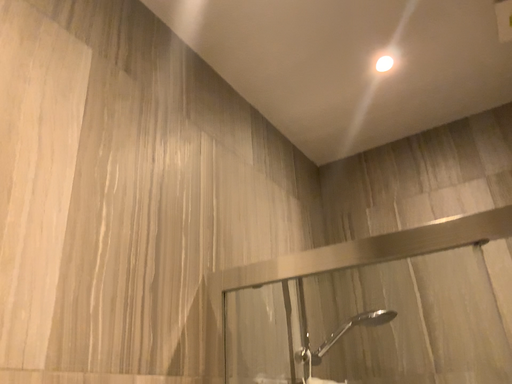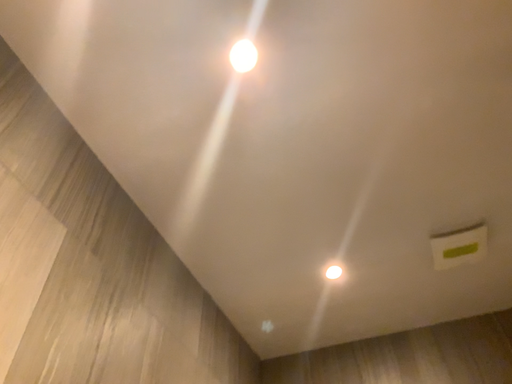
Question: Which way did the camera rotate in the video?

Choices:
 (A) rotated right
 (B) rotated left

Answer: (A)